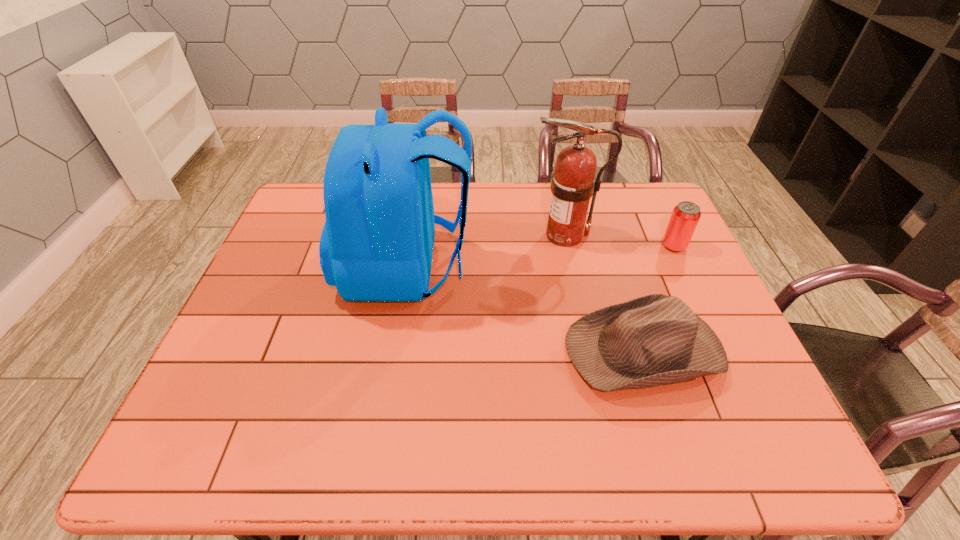
At what (x,y) coordinates should I click in order to perform the action: click on free space that is in between the can and the fire extinguisher. Please return your answer as a coordinate pair (x, y). The width and height of the screenshot is (960, 540). Looking at the image, I should click on (619, 241).

Locate an element on the screen. The width and height of the screenshot is (960, 540). empty space that is in between the fire extinguisher and the fedora is located at coordinates (604, 292).

The width and height of the screenshot is (960, 540). I want to click on vacant region between the fire extinguisher and the fedora, so click(604, 292).

Where is `free space between the can and the leftmost object`? This screenshot has width=960, height=540. free space between the can and the leftmost object is located at coordinates (540, 256).

Identify the location of vacant area between the fire extinguisher and the leftmost object. (486, 251).

This screenshot has width=960, height=540. I want to click on free spot between the fedora and the backpack, so click(525, 307).

Locate which object is the third closest to the can. Please provide its 2D coordinates. Your answer should be formatted as a tuple, i.e. [(x, y)], where the tuple contains the x and y coordinates of a point satisfying the conditions above.

[(377, 242)]

Find the location of a particular element. object that is the nearest to the fire extinguisher is located at coordinates (377, 242).

Where is `free space that satisfies the following two spatial constraints: 1. on the back side of the can; 2. at the nozzle of the fire extinguisher`? The image size is (960, 540). free space that satisfies the following two spatial constraints: 1. on the back side of the can; 2. at the nozzle of the fire extinguisher is located at coordinates (668, 235).

Image resolution: width=960 pixels, height=540 pixels. I want to click on vacant space that satisfies the following two spatial constraints: 1. at the nozzle of the fire extinguisher; 2. on the right side of the fedora, so click(588, 348).